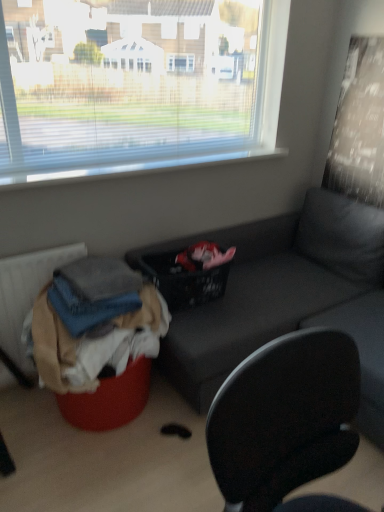
Question: Considering the relative sizes of matte gray couch at center and textured fabric radiator at lower left in the image provided, is matte gray couch at center wider than textured fabric radiator at lower left?

Choices:
 (A) yes
 (B) no

Answer: (A)

Question: Is textured fabric radiator at lower left at the back of matte gray couch at center?

Choices:
 (A) yes
 (B) no

Answer: (B)

Question: From the image's perspective, is matte gray couch at center over textured fabric radiator at lower left?

Choices:
 (A) yes
 (B) no

Answer: (A)

Question: From a real-world perspective, is matte gray couch at center physically above textured fabric radiator at lower left?

Choices:
 (A) no
 (B) yes

Answer: (B)

Question: Considering the relative sizes of matte gray couch at center and textured fabric radiator at lower left in the image provided, is matte gray couch at center bigger than textured fabric radiator at lower left?

Choices:
 (A) yes
 (B) no

Answer: (A)

Question: Is textured fabric radiator at lower left inside or outside of black woven basket at center?

Choices:
 (A) inside
 (B) outside

Answer: (B)

Question: From the image's perspective, relative to black woven basket at center, is textured fabric radiator at lower left above or below?

Choices:
 (A) above
 (B) below

Answer: (B)

Question: From a real-world perspective, relative to black woven basket at center, is textured fabric radiator at lower left vertically above or below?

Choices:
 (A) above
 (B) below

Answer: (B)

Question: Is textured fabric radiator at lower left in front of or behind black woven basket at center in the image?

Choices:
 (A) front
 (B) behind

Answer: (A)

Question: Which is correct: black woven basket at center is inside matte gray couch at center, or outside of it?

Choices:
 (A) inside
 (B) outside

Answer: (A)

Question: Relative to matte gray couch at center, is black woven basket at center in front or behind?

Choices:
 (A) front
 (B) behind

Answer: (B)

Question: Based on their positions, is black woven basket at center located to the left or right of matte gray couch at center?

Choices:
 (A) right
 (B) left

Answer: (B)

Question: Is point (147, 266) closer or farther from the camera than point (173, 329)?

Choices:
 (A) farther
 (B) closer

Answer: (A)

Question: Is black woven basket at center taller or shorter than textured fabric radiator at lower left?

Choices:
 (A) short
 (B) tall

Answer: (A)

Question: From a real-world perspective, is black woven basket at center above or below textured fabric radiator at lower left?

Choices:
 (A) above
 (B) below

Answer: (A)